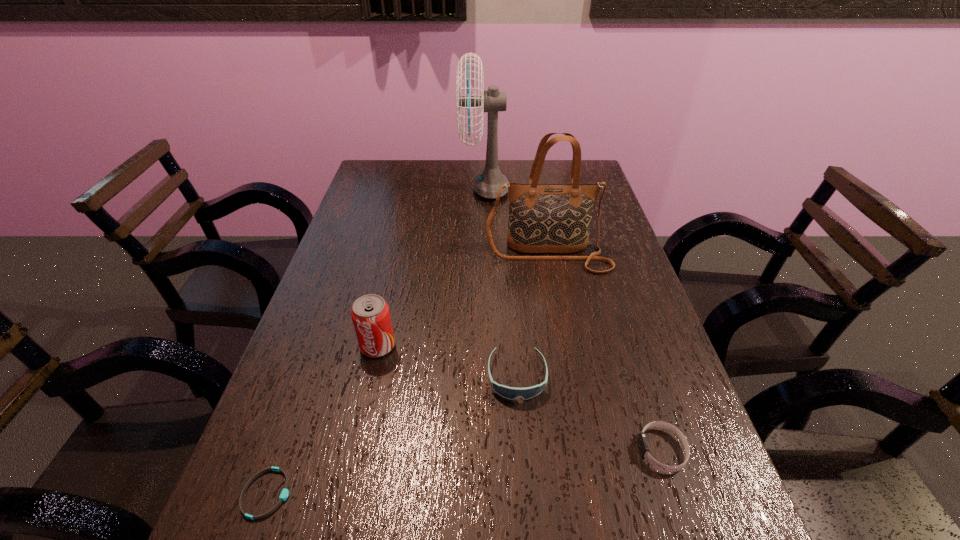
Find the location of a particular element. The image size is (960, 540). vacant area at the far right corner of the desktop is located at coordinates (592, 169).

Where is `free space between the fifth shortest object and the second object from left to right`? The image size is (960, 540). free space between the fifth shortest object and the second object from left to right is located at coordinates (463, 300).

At what (x,y) coordinates should I click in order to perform the action: click on vacant region between the third tallest object and the goggles. Please return your answer as a coordinate pair (x, y). The image size is (960, 540). Looking at the image, I should click on (447, 361).

The image size is (960, 540). I want to click on empty space that is in between the second object from left to right and the shorter wristband, so click(323, 420).

At what (x,y) coordinates should I click in order to perform the action: click on free space between the fifth tallest object and the handbag. Please return your answer as a coordinate pair (x, y). Looking at the image, I should click on (605, 353).

You are a GUI agent. You are given a task and a screenshot of the screen. Output one action in this format:
    pyautogui.click(x=<x>, y=<y>)
    Task: Click on the vacant area that lies between the fifth tallest object and the shortest object
    This screenshot has height=540, width=960.
    Given the screenshot: What is the action you would take?
    pyautogui.click(x=465, y=472)

This screenshot has width=960, height=540. I want to click on empty space that is in between the goggles and the right wristband, so pyautogui.click(x=589, y=413).

You are a GUI agent. You are given a task and a screenshot of the screen. Output one action in this format:
    pyautogui.click(x=<x>, y=<y>)
    Task: Click on the unoccupied position between the right wristband and the fan
    Image resolution: width=960 pixels, height=540 pixels.
    Given the screenshot: What is the action you would take?
    pyautogui.click(x=573, y=319)

You are a GUI agent. You are given a task and a screenshot of the screen. Output one action in this format:
    pyautogui.click(x=<x>, y=<y>)
    Task: Click on the free space between the second shortest object and the fan
    This screenshot has width=960, height=540.
    Given the screenshot: What is the action you would take?
    pyautogui.click(x=573, y=319)

Where is `unoccupied area between the fan and the fourth tallest object`? unoccupied area between the fan and the fourth tallest object is located at coordinates (501, 282).